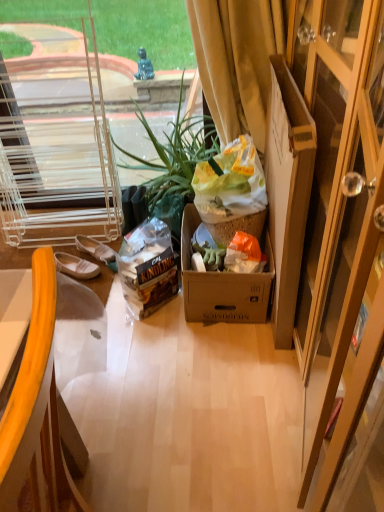
Question: Does green leafy plant at center contain yellow plastic chair at left?

Choices:
 (A) yes
 (B) no

Answer: (B)

Question: Is green leafy plant at center beside yellow plastic chair at left?

Choices:
 (A) no
 (B) yes

Answer: (A)

Question: From the image's perspective, is green leafy plant at center located beneath yellow plastic chair at left?

Choices:
 (A) no
 (B) yes

Answer: (A)

Question: Does green leafy plant at center have a larger size compared to yellow plastic chair at left?

Choices:
 (A) no
 (B) yes

Answer: (B)

Question: Is green leafy plant at center smaller than yellow plastic chair at left?

Choices:
 (A) no
 (B) yes

Answer: (A)

Question: Considering the relative sizes of green leafy plant at center and yellow plastic chair at left in the image provided, is green leafy plant at center wider than yellow plastic chair at left?

Choices:
 (A) yes
 (B) no

Answer: (A)

Question: Is yellow velvet curtain at upper right outside white canvas slipper at lower left?

Choices:
 (A) yes
 (B) no

Answer: (A)

Question: Is yellow velvet curtain at upper right at the right side of white canvas slipper at lower left?

Choices:
 (A) no
 (B) yes

Answer: (B)

Question: Could you tell me if yellow velvet curtain at upper right is facing white canvas slipper at lower left?

Choices:
 (A) no
 (B) yes

Answer: (A)

Question: Is yellow velvet curtain at upper right to the left of white canvas slipper at lower left from the viewer's perspective?

Choices:
 (A) no
 (B) yes

Answer: (A)

Question: Can you confirm if yellow velvet curtain at upper right is taller than white canvas slipper at lower left?

Choices:
 (A) yes
 (B) no

Answer: (A)

Question: Can you see yellow velvet curtain at upper right touching white canvas slipper at lower left?

Choices:
 (A) yes
 (B) no

Answer: (B)

Question: Is yellow plastic chair at left to the right of cardboard box at right from the viewer's perspective?

Choices:
 (A) yes
 (B) no

Answer: (B)